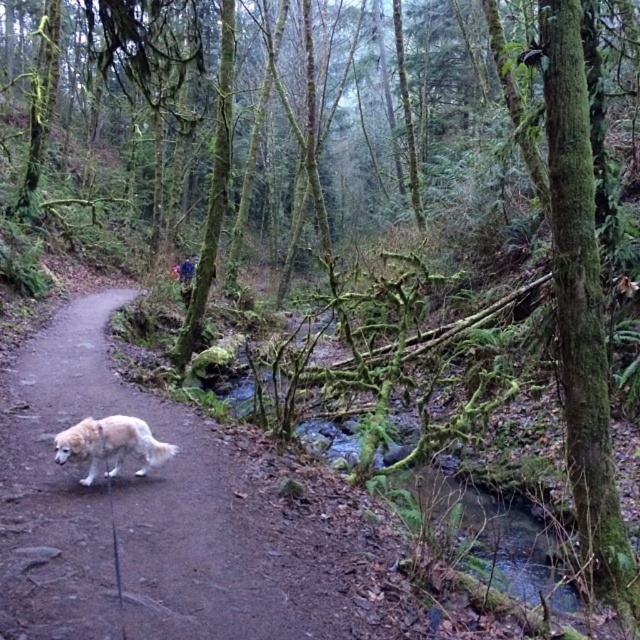
Question: Considering the relative positions of brown dirt path at center and white fluffy dog at lower left in the image provided, where is brown dirt path at center located with respect to white fluffy dog at lower left?

Choices:
 (A) above
 (B) below

Answer: (B)

Question: Is brown dirt path at center smaller than white fluffy dog at lower left?

Choices:
 (A) no
 (B) yes

Answer: (A)

Question: Among these objects, which one is nearest to the camera?

Choices:
 (A) white fluffy dog at lower left
 (B) brown dirt path at center

Answer: (B)

Question: Does brown dirt path at center appear on the right side of white fluffy dog at lower left?

Choices:
 (A) no
 (B) yes

Answer: (A)

Question: Which point is farther to the camera?

Choices:
 (A) brown dirt path at center
 (B) white fluffy dog at lower left

Answer: (B)